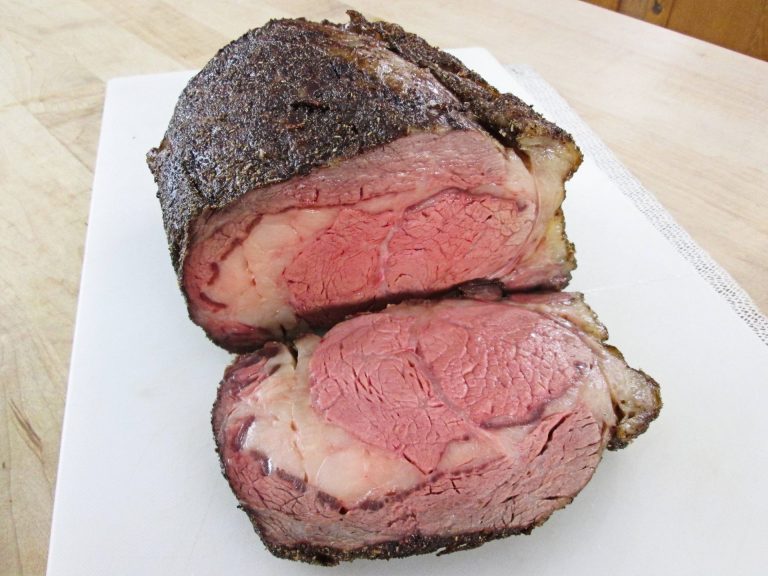
Image resolution: width=768 pixels, height=576 pixels. In order to click on black spot on cabinet in this screenshot , I will do `click(656, 10)`.